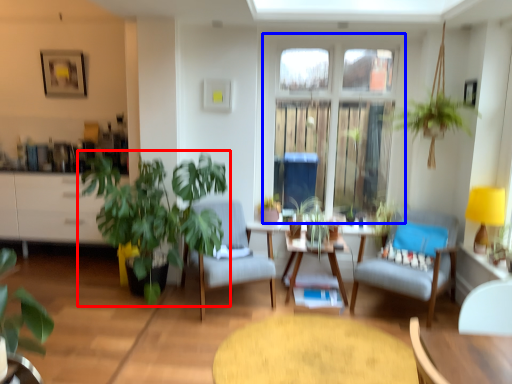
Question: Which of the following is the farthest to the observer, houseplant (highlighted by a red box) or window (highlighted by a blue box)?

Choices:
 (A) houseplant
 (B) window

Answer: (B)